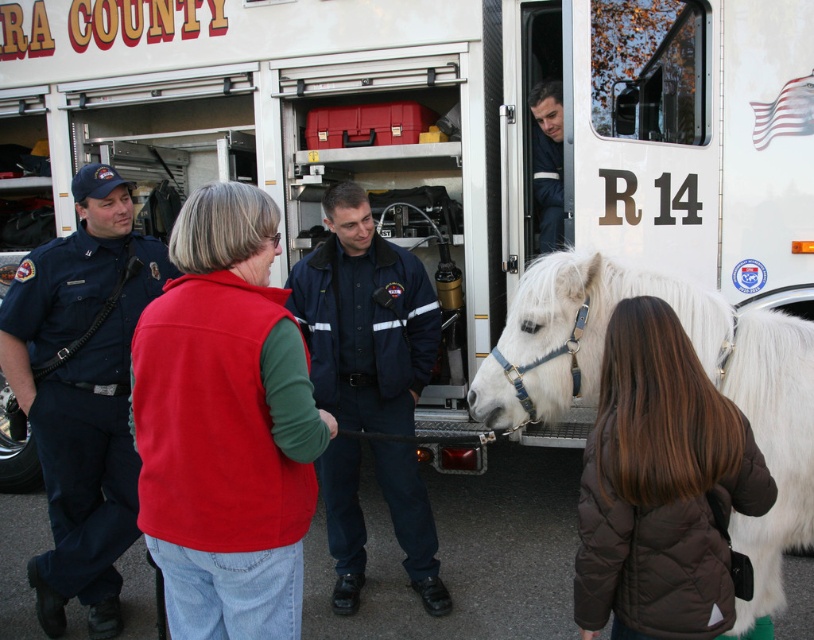
Can you confirm if white silky horse at right is smaller than navy blue uniform at center?

Actually, white silky horse at right might be larger than navy blue uniform at center.

Which is more to the left, white silky horse at right or navy blue uniform at center?

From the viewer's perspective, navy blue uniform at center appears more on the left side.

Locate an element on the screen. The width and height of the screenshot is (814, 640). white silky horse at right is located at coordinates (701, 364).

Where is `white silky horse at right`? The height and width of the screenshot is (640, 814). white silky horse at right is located at coordinates (701, 364).

This screenshot has width=814, height=640. I want to click on dark blue uniform at left, so click(x=82, y=392).

Identify the location of dark blue uniform at left. click(x=82, y=392).

Does point (40, 304) come behind point (550, 160)?

No, (40, 304) is in front of (550, 160).

Does dark blue uniform at left have a greater height compared to blue uniform at center?

Indeed, dark blue uniform at left has a greater height compared to blue uniform at center.

At what (x,y) coordinates should I click in order to perform the action: click on dark blue uniform at left. Please return your answer as a coordinate pair (x, y). Looking at the image, I should click on (82, 392).